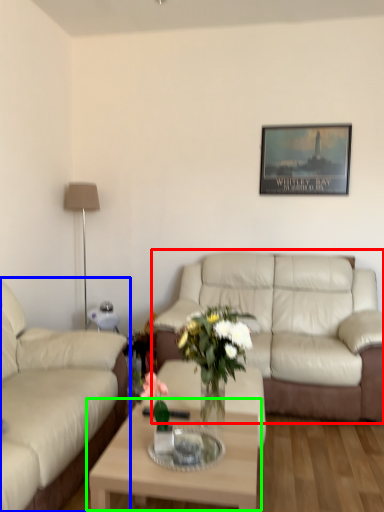
Question: Which is farther away from studio couch (highlighted by a red box)? studio couch (highlighted by a blue box) or coffee table (highlighted by a green box)?

Choices:
 (A) studio couch
 (B) coffee table

Answer: (A)